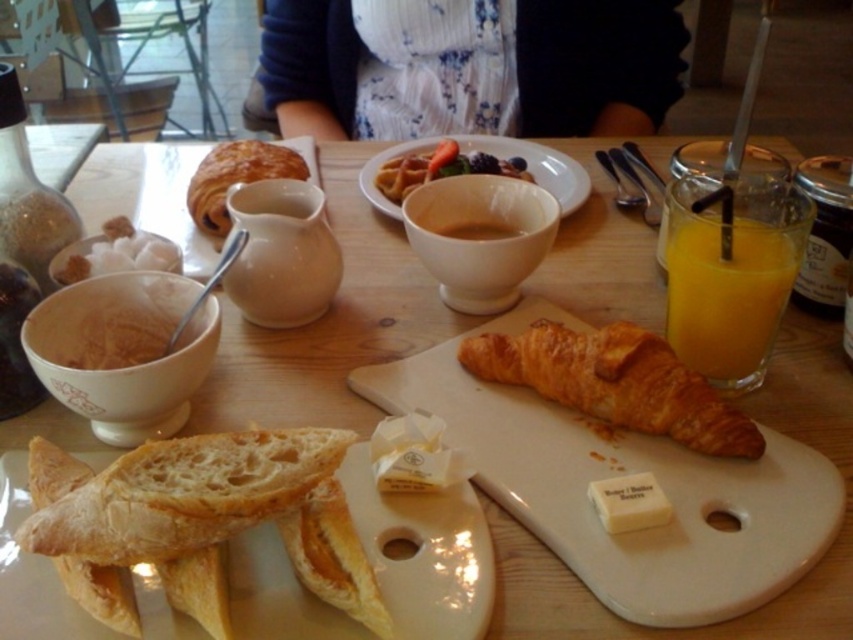
What do you see at coordinates (425, 554) in the screenshot?
I see `golden brown bread at center` at bounding box center [425, 554].

Which is more to the left, golden brown bread at center or white soft butter at center?

golden brown bread at center

Does point (393, 588) come closer to viewer compared to point (643, 490)?

Yes, it is.

Find the location of a particular element. golden brown bread at center is located at coordinates pos(425,554).

Can you confirm if golden brown croissant at lower left is positioned to the right of translucent glass cup at right?

No, golden brown croissant at lower left is not to the right of translucent glass cup at right.

Between golden brown croissant at lower left and translucent glass cup at right, which one is positioned lower?

golden brown croissant at lower left is below.

Image resolution: width=853 pixels, height=640 pixels. What do you see at coordinates (184, 493) in the screenshot? I see `golden brown croissant at lower left` at bounding box center [184, 493].

Identify the location of golden brown croissant at lower left. The image size is (853, 640). (184, 493).

Does white ceramic platter at center have a larger size compared to white soft butter at center?

Yes.

Measure the distance from white ceramic platter at center to white soft butter at center.

The distance of white ceramic platter at center from white soft butter at center is 2.53 inches.

Is point (780, 561) positioned behind point (653, 493)?

No, (780, 561) is in front of (653, 493).

This screenshot has height=640, width=853. I want to click on white ceramic platter at center, so click(624, 474).